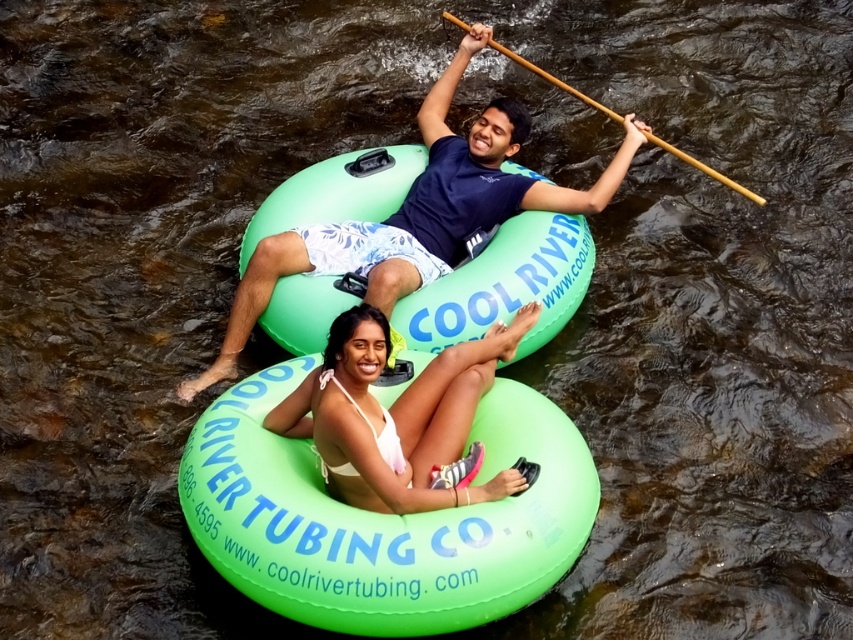
Can you confirm if matte green tube at center is positioned to the left of white bikini bottom at center?

Indeed, matte green tube at center is positioned on the left side of white bikini bottom at center.

Who is more forward, (190, 397) or (350, 396)?

Point (350, 396) is more forward.

This screenshot has height=640, width=853. I want to click on matte green tube at center, so click(x=418, y=212).

Locate an element on the screen. This screenshot has width=853, height=640. matte green tube at center is located at coordinates (418, 212).

The height and width of the screenshot is (640, 853). What do you see at coordinates (418, 212) in the screenshot?
I see `matte green tube at center` at bounding box center [418, 212].

Which is in front, point (471, 141) or point (668, 150)?

Positioned in front is point (471, 141).

Who is more forward, (480, 128) or (547, 74)?

Point (480, 128)

Find the location of a particular element. The width and height of the screenshot is (853, 640). matte green tube at center is located at coordinates tap(418, 212).

Is point (538, 307) positioned behind point (740, 186)?

No.

Which is in front, point (331, 424) or point (672, 148)?

Point (331, 424) is in front.

Where is `white bikini bottom at center`? white bikini bottom at center is located at coordinates (399, 419).

In order to click on white bikini bottom at center in this screenshot , I will do `click(399, 419)`.